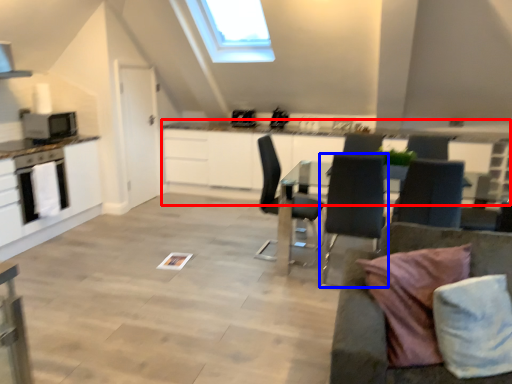
Question: Among these objects, which one is nearest to the camera, counter (highlighted by a red box) or chair (highlighted by a blue box)?

Choices:
 (A) counter
 (B) chair

Answer: (B)